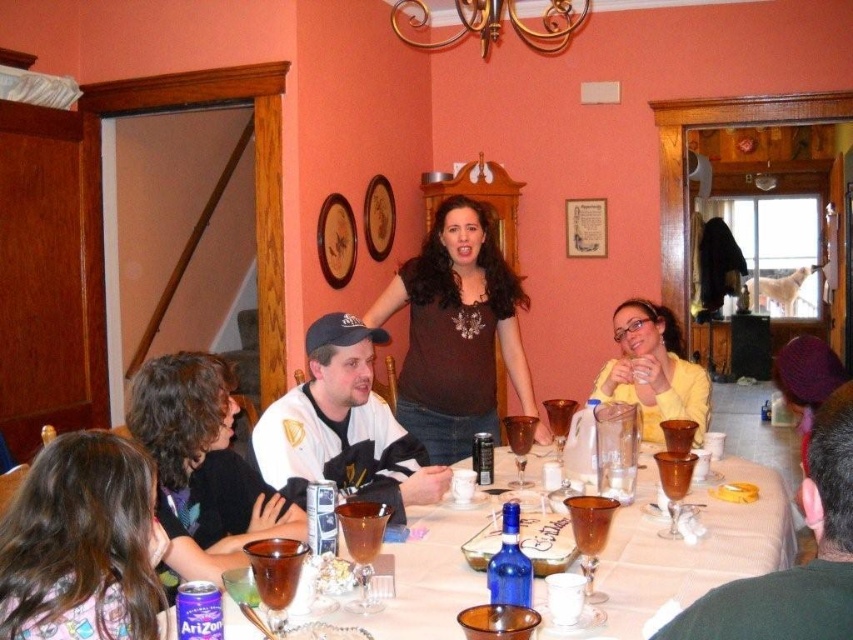
Does smooth brown hair at lower left have a smaller size compared to white frosted cake at center?

Incorrect, smooth brown hair at lower left is not smaller in size than white frosted cake at center.

Consider the image. Is smooth brown hair at lower left in front of white frosted cake at center?

Yes, smooth brown hair at lower left is closer to the viewer.

Between point (10, 532) and point (340, 586), which one is positioned in front?

Point (10, 532)

Locate an element on the screen. Image resolution: width=853 pixels, height=640 pixels. smooth brown hair at lower left is located at coordinates (80, 541).

Is brown matte shirt at center taller than gold metallic chandelier at upper center?

Indeed, brown matte shirt at center has a greater height compared to gold metallic chandelier at upper center.

Which is more to the right, brown matte shirt at center or gold metallic chandelier at upper center?

gold metallic chandelier at upper center

Locate an element on the screen. Image resolution: width=853 pixels, height=640 pixels. brown matte shirt at center is located at coordinates (456, 332).

Does brown matte shirt at center have a larger size compared to white frosted cake at center?

Yes, brown matte shirt at center is bigger than white frosted cake at center.

Is brown matte shirt at center wider than white frosted cake at center?

Yes, brown matte shirt at center is wider than white frosted cake at center.

Where is `brown matte shirt at center`? The image size is (853, 640). brown matte shirt at center is located at coordinates (456, 332).

Locate an element on the screen. brown matte shirt at center is located at coordinates (456, 332).